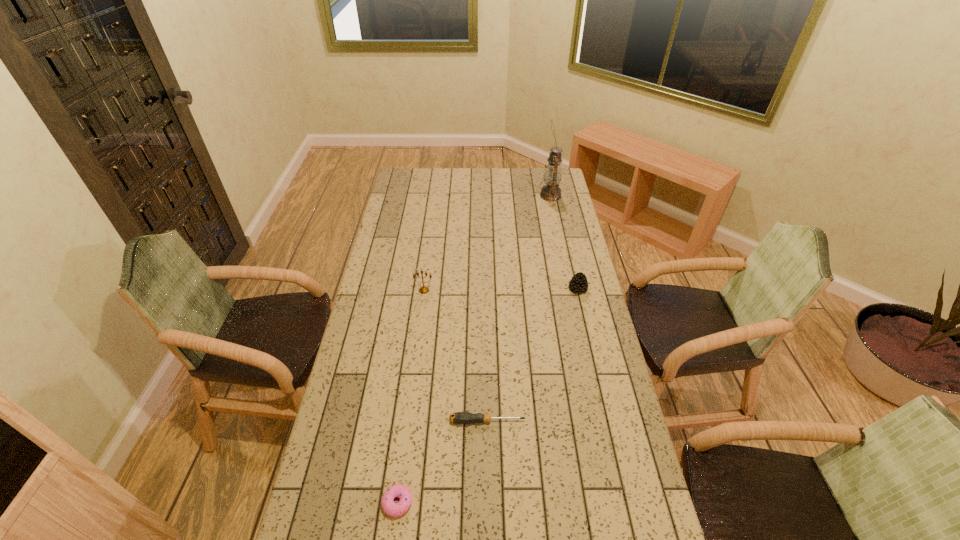
You are a GUI agent. You are given a task and a screenshot of the screen. Output one action in this format:
    pyautogui.click(x=<x>, y=<y>)
    Task: Click on the oil lamp
    The height and width of the screenshot is (540, 960).
    Given the screenshot: What is the action you would take?
    pyautogui.click(x=553, y=173)

Locate an element on the screen. the tallest object is located at coordinates (553, 173).

Where is `the fourth shortest object`? Image resolution: width=960 pixels, height=540 pixels. the fourth shortest object is located at coordinates (423, 290).

You are a GUI agent. You are given a task and a screenshot of the screen. Output one action in this format:
    pyautogui.click(x=<x>, y=<y>)
    Task: Click on the third shortest object
    
    Given the screenshot: What is the action you would take?
    pyautogui.click(x=579, y=284)

At what (x,y) coordinates should I click in order to perform the action: click on the third object from left to right. Please return your answer as a coordinate pair (x, y). Looking at the image, I should click on (458, 417).

I want to click on the fourth farthest object, so click(458, 417).

Locate an element on the screen. The width and height of the screenshot is (960, 540). the nearest object is located at coordinates (392, 509).

What are the coordinates of `free space located on the left of the oil lamp` in the screenshot? It's located at [x=512, y=195].

Locate an element on the screen. blank space located 0.050m on the front of the fourth shortest object is located at coordinates (422, 303).

Where is `free space located 0.120m at the narrow end of the pinecone`? The height and width of the screenshot is (540, 960). free space located 0.120m at the narrow end of the pinecone is located at coordinates (585, 318).